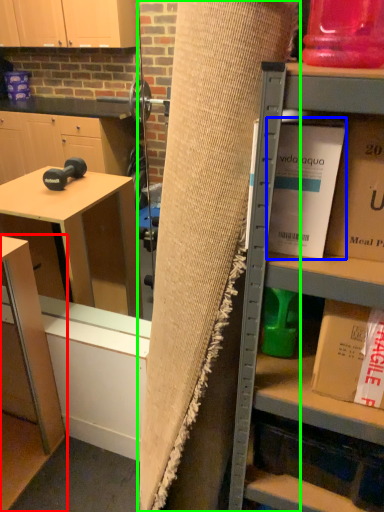
Question: Considering the real-world distances, which object is closest to table (highlighted by a red box)? book (highlighted by a blue box) or curtain (highlighted by a green box).

Choices:
 (A) book
 (B) curtain

Answer: (B)